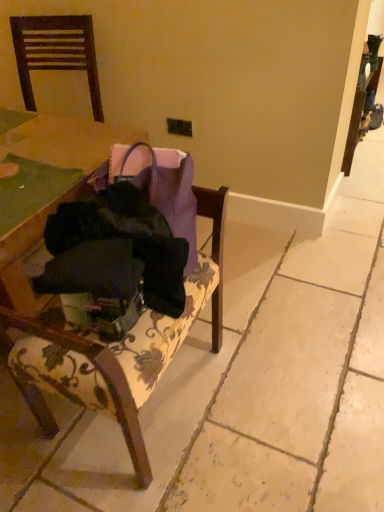
Question: From a real-world perspective, is dark wood chair at upper left, which appears as the first chair when viewed from the top, positioned over velvet floral-patterned chair at center, the 1th chair from the bottom, based on gravity?

Choices:
 (A) no
 (B) yes

Answer: (B)

Question: Does dark wood chair at upper left, acting as the 2th chair starting from the right, appear on the left side of velvet floral-patterned chair at center, which appears as the 2th chair when viewed from the top?

Choices:
 (A) yes
 (B) no

Answer: (A)

Question: Does dark wood chair at upper left, acting as the 2th chair starting from the right, come behind velvet floral-patterned chair at center, acting as the 2th chair starting from the left?

Choices:
 (A) yes
 (B) no

Answer: (A)

Question: From a real-world perspective, is dark wood chair at upper left, which appears as the first chair when viewed from the top, under velvet floral-patterned chair at center, which is counted as the 1th chair, starting from the right?

Choices:
 (A) no
 (B) yes

Answer: (A)

Question: Does dark wood chair at upper left, which appears as the first chair when viewed from the top, have a greater height compared to velvet floral-patterned chair at center, the 1th chair from the bottom?

Choices:
 (A) no
 (B) yes

Answer: (A)

Question: Is dark wood chair at upper left, which appears as the second chair when ordered from the bottom, taller or shorter than velvet floral-patterned chair at center, the 1th chair from the bottom?

Choices:
 (A) tall
 (B) short

Answer: (B)

Question: Is dark wood chair at upper left, which appears as the first chair when viewed from the top, bigger or smaller than velvet floral-patterned chair at center, which is counted as the 1th chair, starting from the right?

Choices:
 (A) small
 (B) big

Answer: (A)

Question: Is point pos(46,41) positioned closer to the camera than point pos(51,308)?

Choices:
 (A) farther
 (B) closer

Answer: (A)

Question: From a real-world perspective, is dark wood chair at upper left, positioned as the 1th chair in left-to-right order, above or below velvet floral-patterned chair at center, acting as the 2th chair starting from the left?

Choices:
 (A) above
 (B) below

Answer: (A)

Question: Looking at their shapes, would you say black fabric bag at center is wider or thinner than dark wood chair at upper left, which appears as the second chair when ordered from the bottom?

Choices:
 (A) wide
 (B) thin

Answer: (B)

Question: Relative to dark wood chair at upper left, acting as the 2th chair starting from the right, is black fabric bag at center in front or behind?

Choices:
 (A) behind
 (B) front

Answer: (B)

Question: From the image's perspective, relative to dark wood chair at upper left, acting as the 2th chair starting from the right, is black fabric bag at center above or below?

Choices:
 (A) below
 (B) above

Answer: (A)

Question: Considering the positions of black fabric bag at center and dark wood chair at upper left, which appears as the first chair when viewed from the top, in the image, is black fabric bag at center bigger or smaller than dark wood chair at upper left, which appears as the first chair when viewed from the top,?

Choices:
 (A) big
 (B) small

Answer: (B)

Question: Does point (148, 253) appear closer or farther from the camera than point (205, 202)?

Choices:
 (A) farther
 (B) closer

Answer: (B)

Question: Considering the positions of black fabric bag at center and velvet floral-patterned chair at center, the 1th chair from the bottom, in the image, is black fabric bag at center wider or thinner than velvet floral-patterned chair at center, the 1th chair from the bottom,?

Choices:
 (A) wide
 (B) thin

Answer: (B)